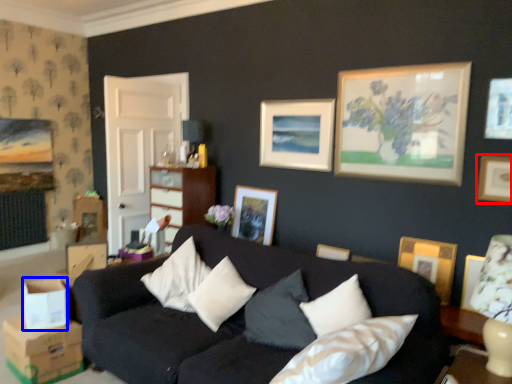
Question: Which object appears closest to the camera in this image, picture frame (highlighted by a red box) or cardboard box (highlighted by a blue box)?

Choices:
 (A) picture frame
 (B) cardboard box

Answer: (B)